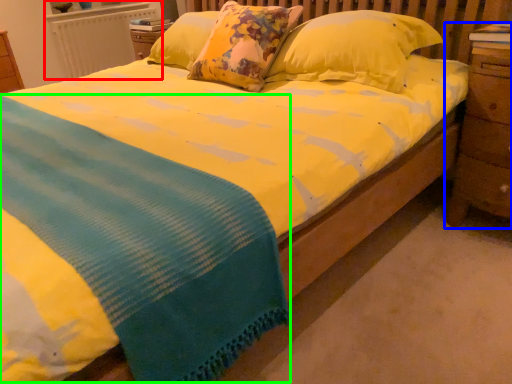
Question: Which is nearer to the radiator (highlighted by a red box)? nightstand (highlighted by a blue box) or blanket (highlighted by a green box).

Choices:
 (A) nightstand
 (B) blanket

Answer: (B)